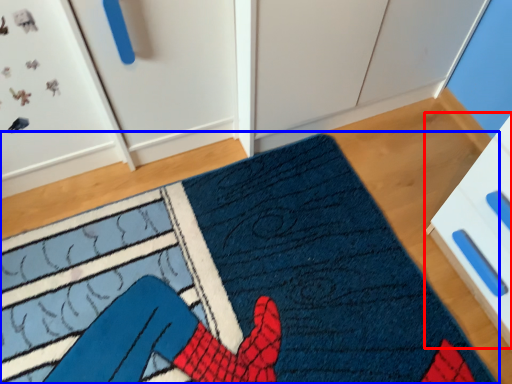
Question: Among these objects, which one is nearest to the camera, drawer (highlighted by a red box) or doormat (highlighted by a blue box)?

Choices:
 (A) drawer
 (B) doormat

Answer: (A)